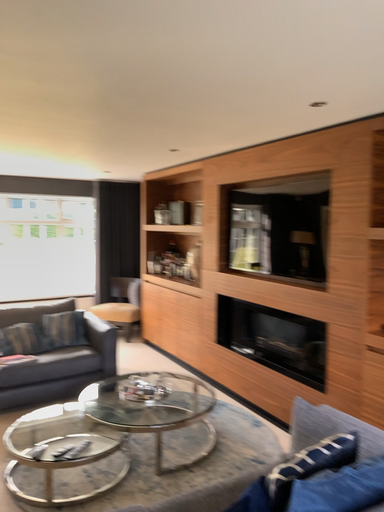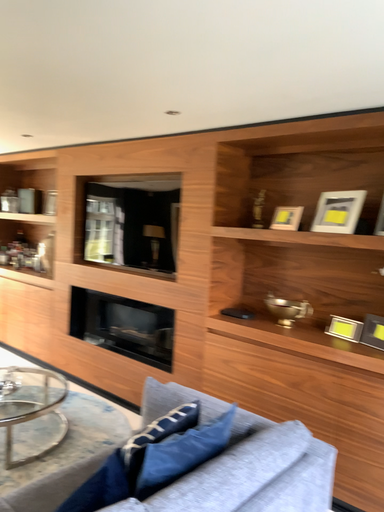
Question: How did the camera likely rotate when shooting the video?

Choices:
 (A) rotated right
 (B) rotated left

Answer: (A)